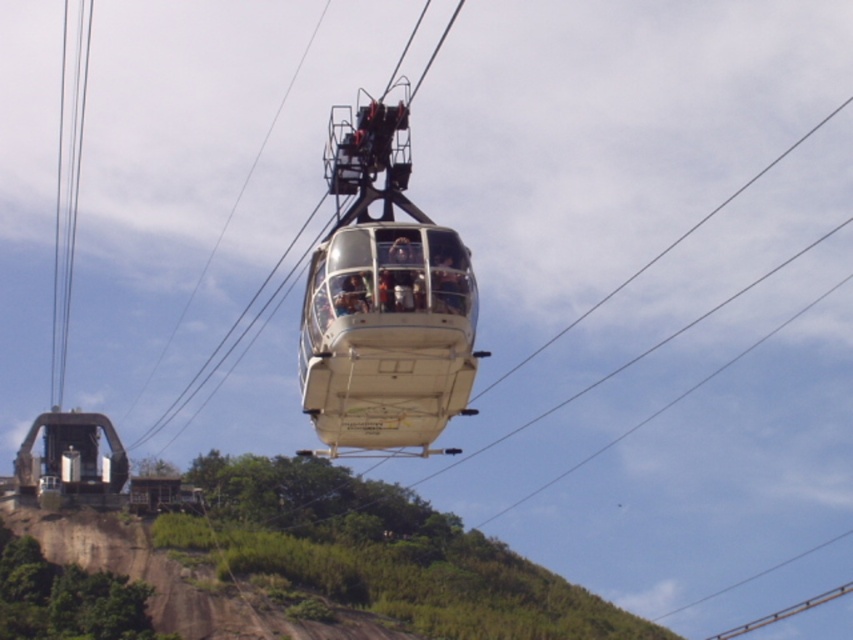
Question: Which of the following is the farthest from the observer?

Choices:
 (A) (328, 442)
 (B) (73, 72)

Answer: (B)

Question: Can you confirm if white glossy cable car at center is bigger than clear glass cables at upper left?

Choices:
 (A) no
 (B) yes

Answer: (B)

Question: Does white glossy cable car at center have a smaller size compared to clear glass cables at upper left?

Choices:
 (A) yes
 (B) no

Answer: (B)

Question: Which object is closer to the camera taking this photo?

Choices:
 (A) white glossy cable car at center
 (B) clear glass cables at upper left

Answer: (A)

Question: Is white glossy cable car at center closer to camera compared to clear glass cables at upper left?

Choices:
 (A) no
 (B) yes

Answer: (B)